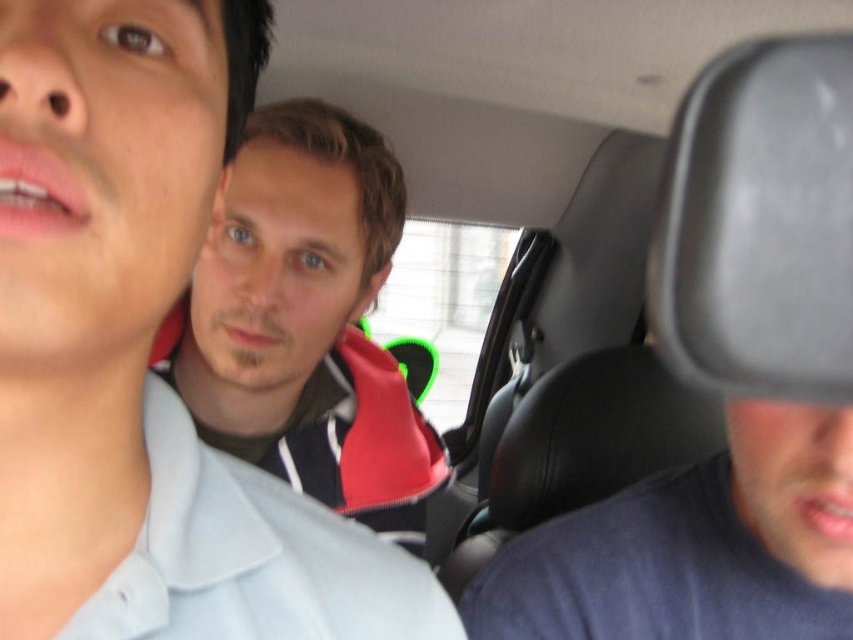
Question: Is dark blue hoodie at center smaller than dark blue t-shirt at lower right?

Choices:
 (A) yes
 (B) no

Answer: (B)

Question: Does dark blue hoodie at center appear on the left side of dark blue t-shirt at lower right?

Choices:
 (A) no
 (B) yes

Answer: (B)

Question: Which object appears farthest from the camera in this image?

Choices:
 (A) dark blue t-shirt at lower right
 (B) dark blue hoodie at center

Answer: (B)

Question: From the image, what is the correct spatial relationship of dark blue hoodie at center in relation to dark blue t-shirt at lower right?

Choices:
 (A) right
 (B) left

Answer: (B)